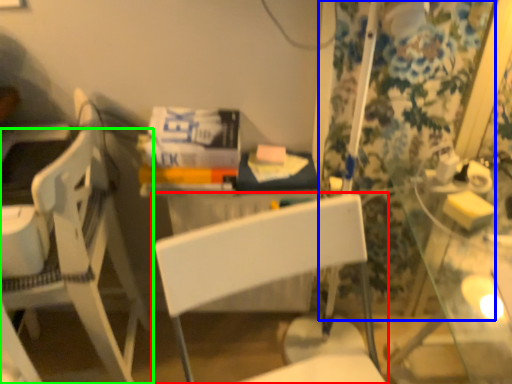
Question: Which is farther away from chair (highlighted by a red box)? curtain (highlighted by a blue box) or chair (highlighted by a green box)?

Choices:
 (A) curtain
 (B) chair

Answer: (A)